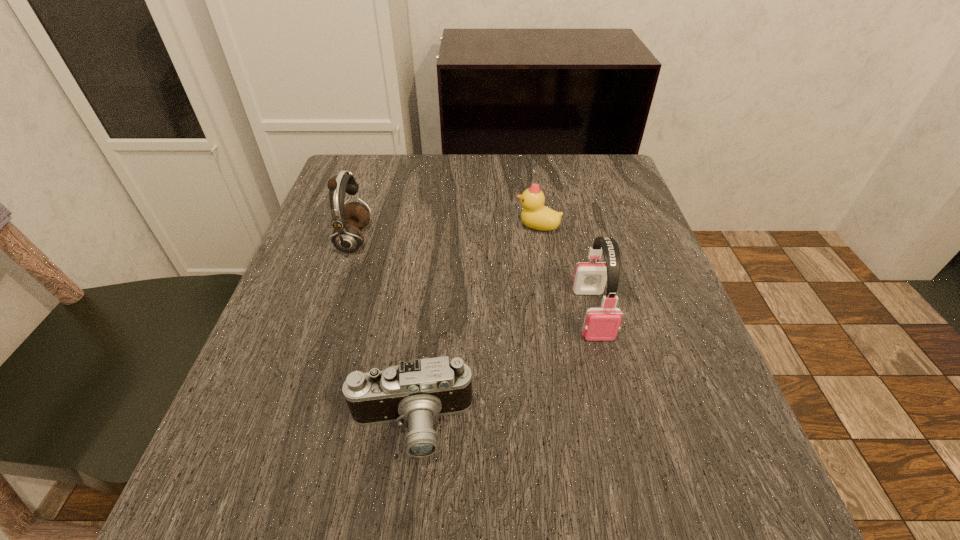
The height and width of the screenshot is (540, 960). What are the coordinates of `vacant area between the duckling and the nearest object` in the screenshot? It's located at (474, 326).

I want to click on object that is the third closest to the second object from left to right, so click(535, 215).

Select which object appears as the third closest to the farther earphone. Please provide its 2D coordinates. Your answer should be formatted as a tuple, i.e. [(x, y)], where the tuple contains the x and y coordinates of a point satisfying the conditions above.

[(601, 324)]

This screenshot has height=540, width=960. Identify the location of free space that satisfies the following two spatial constraints: 1. on the front-facing side of the duckling; 2. at the lens of the camera. (568, 426).

Locate an element on the screen. vacant space that satisfies the following two spatial constraints: 1. on the front-facing side of the duckling; 2. at the lens of the camera is located at coordinates (568, 426).